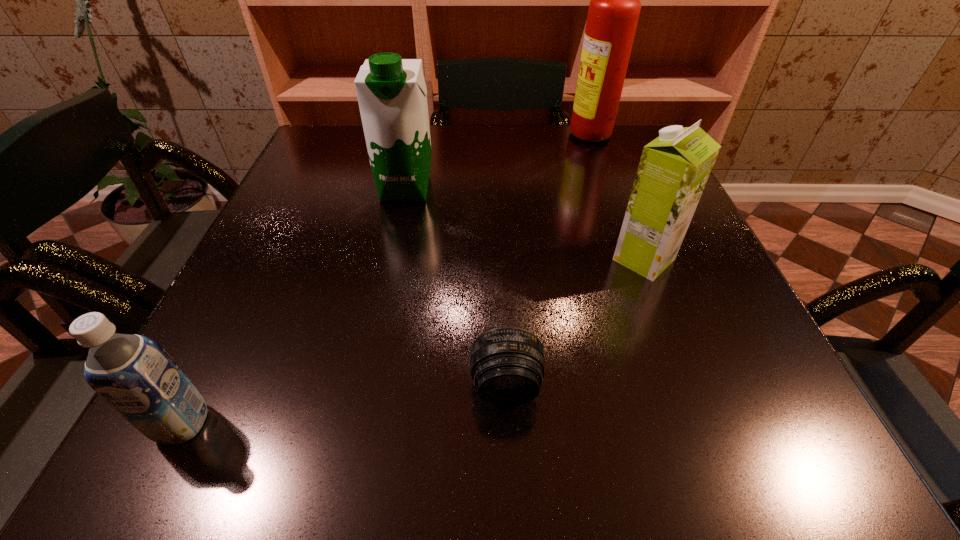
Where is `fire extinguisher at the right edge`? This screenshot has width=960, height=540. fire extinguisher at the right edge is located at coordinates (614, 9).

Locate an element on the screen. soya milk located in the right edge section of the desktop is located at coordinates (674, 168).

This screenshot has height=540, width=960. I want to click on object positioned at the near left corner, so click(132, 373).

The width and height of the screenshot is (960, 540). In order to click on object located at the far right corner in this screenshot , I will do `click(614, 9)`.

The width and height of the screenshot is (960, 540). I want to click on free space at the far edge, so click(x=370, y=171).

Identify the location of blank area at the near edge. The image size is (960, 540). (636, 430).

Identify the location of free region at the left edge of the desktop. (321, 254).

Identify the location of vacant space at the right edge. The height and width of the screenshot is (540, 960). (711, 315).

Find the location of a particular element. This screenshot has width=960, height=540. vacant space at the far left corner of the desktop is located at coordinates (341, 158).

At what (x,y) coordinates should I click in order to perform the action: click on vacant space at the near left corner of the desktop. Please return your answer as a coordinate pair (x, y). This screenshot has height=540, width=960. Looking at the image, I should click on (180, 456).